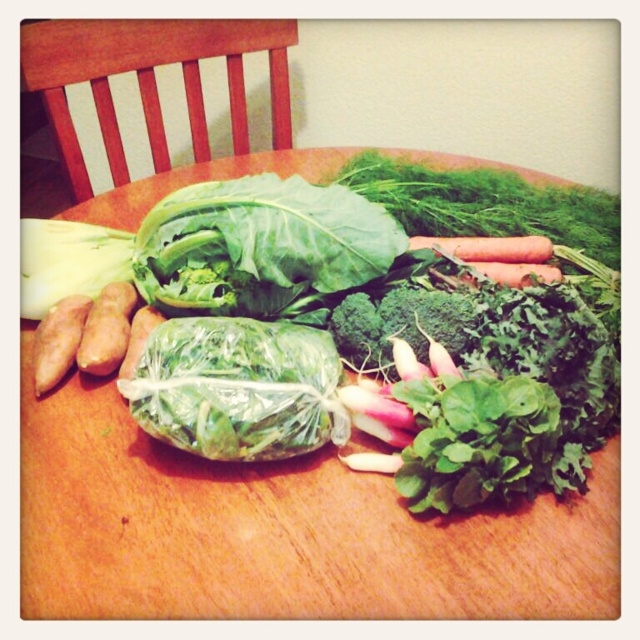
Does green leafy vegetables at center have a larger size compared to green plastic-wrapped cabbage at center?

Yes.

Based on the photo, does green leafy vegetables at center have a greater height compared to green plastic-wrapped cabbage at center?

Indeed, green leafy vegetables at center has a greater height compared to green plastic-wrapped cabbage at center.

Locate an element on the screen. The width and height of the screenshot is (640, 640). green leafy vegetables at center is located at coordinates (280, 531).

Between point (92, 372) and point (65, 340), which one is positioned behind?

The point (65, 340) is more distant.

Between brown matte sweet potato at left and smooth orange sweet potato at left, which one has more height?

With more height is smooth orange sweet potato at left.

Where is `brown matte sweet potato at left`? The image size is (640, 640). brown matte sweet potato at left is located at coordinates (106, 330).

Does point (384, 250) lie behind point (224, 454)?

Yes, point (384, 250) is farther from viewer.

Is green leafy at center shorter than green plastic-wrapped cabbage at center?

No.

Which is in front, point (205, 208) or point (259, 390)?

Point (259, 390) is more forward.

Where is `green leafy at center`? The width and height of the screenshot is (640, 640). green leafy at center is located at coordinates (260, 244).